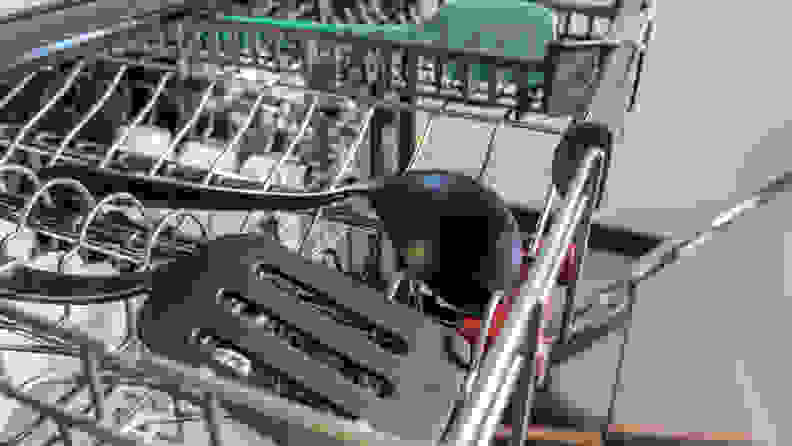
At what (x,y) coordinates should I click in order to perform the action: click on pixelated photo of open dishwasher. Please return your answer as a coordinate pair (x, y). Looking at the image, I should click on (446, 138).